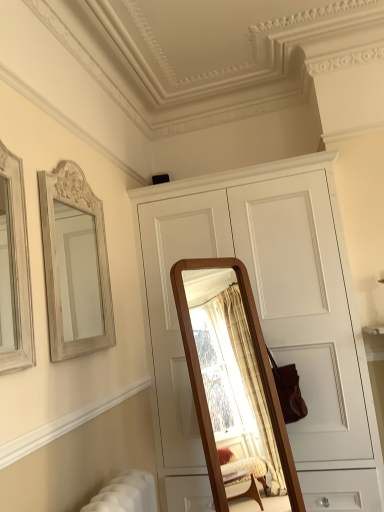
What is the approximate height of white wood cabinet at center?

white wood cabinet at center is 2.23 meters tall.

I want to click on white wood cabinet at center, so click(x=265, y=318).

Image resolution: width=384 pixels, height=512 pixels. What do you see at coordinates (75, 264) in the screenshot?
I see `white carved wood mirror at upper left` at bounding box center [75, 264].

Locate an element on the screen. The image size is (384, 512). wooden frame mirror at left is located at coordinates (14, 269).

From the picture: Is white carved wood mirror at upper left facing towards wooden frame mirror at left?

No, white carved wood mirror at upper left is not aimed at wooden frame mirror at left.

From the image's perspective, is white carved wood mirror at upper left over wooden frame mirror at left?

No, from the image's perspective, white carved wood mirror at upper left is not above wooden frame mirror at left.

Locate an element on the screen. mirror on the right of wooden frame mirror at left is located at coordinates (75, 264).

Which object is closer to the camera, white carved wood mirror at upper left or wooden frame mirror at left?

wooden frame mirror at left.

From the image's perspective, which is above, white carved wood mirror at upper left or white wood cabinet at center?

white carved wood mirror at upper left.

Is white carved wood mirror at upper left closer to the viewer compared to white wood cabinet at center?

Yes, white carved wood mirror at upper left is closer to the viewer.

Does white carved wood mirror at upper left have a greater height compared to white wood cabinet at center?

No.

Is white carved wood mirror at upper left positioned with its back to white wood cabinet at center?

That's not correct — white carved wood mirror at upper left is not looking away from white wood cabinet at center.

Which is correct: white wood cabinet at center is inside white carved wood mirror at upper left, or outside of it?

white wood cabinet at center lies outside white carved wood mirror at upper left.

Is white wood cabinet at center oriented towards white carved wood mirror at upper left?

Yes, white wood cabinet at center is facing white carved wood mirror at upper left.

Considering the positions of objects white wood cabinet at center and white carved wood mirror at upper left in the image provided, who is more to the left, white wood cabinet at center or white carved wood mirror at upper left?

white carved wood mirror at upper left is more to the left.

Is wooden frame mirror at left spatially inside white carved wood mirror at upper left, or outside of it?

The correct answer is: outside.

From the picture: Is wooden frame mirror at left at the right side of white carved wood mirror at upper left?

Incorrect, wooden frame mirror at left is not on the right side of white carved wood mirror at upper left.

From the image's perspective, is wooden frame mirror at left on top of white carved wood mirror at upper left?

Correct, wooden frame mirror at left appears higher than white carved wood mirror at upper left in the image.

Who is taller, white wood cabinet at center or wooden frame mirror at left?

white wood cabinet at center is taller.

You are a GUI agent. You are given a task and a screenshot of the screen. Output one action in this format:
    pyautogui.click(x=<x>, y=<y>)
    Task: Click on the picture frame that is in front of the white wood cabinet at center
    The width and height of the screenshot is (384, 512).
    Given the screenshot: What is the action you would take?
    pyautogui.click(x=14, y=269)

Which object is positioned more to the right, white wood cabinet at center or wooden frame mirror at left?

white wood cabinet at center.

Considering the sizes of objects white wood cabinet at center and wooden frame mirror at left in the image provided, who is bigger, white wood cabinet at center or wooden frame mirror at left?

white wood cabinet at center.

Who is taller, wooden frame mirror at left or white wood cabinet at center?

white wood cabinet at center.

Looking at their sizes, would you say wooden frame mirror at left is wider or thinner than white wood cabinet at center?

wooden frame mirror at left is thinner than white wood cabinet at center.

Relative to white wood cabinet at center, is wooden frame mirror at left in front or behind?

In the image, wooden frame mirror at left appears in front of white wood cabinet at center.

From a real-world perspective, is wooden frame mirror at left on white wood cabinet at center?

Indeed, from a real-world perspective, wooden frame mirror at left stands above white wood cabinet at center.

Where is `mirror behind the wooden frame mirror at left`? Image resolution: width=384 pixels, height=512 pixels. mirror behind the wooden frame mirror at left is located at coordinates (75, 264).

The width and height of the screenshot is (384, 512). Find the location of `cabinetry below the white carved wood mirror at upper left (from the image's perspective)`. cabinetry below the white carved wood mirror at upper left (from the image's perspective) is located at coordinates (265, 318).

Based on the photo, when comparing their distances from white carved wood mirror at upper left, does wooden frame mirror at left or white wood cabinet at center seem further?

white wood cabinet at center lies further to white carved wood mirror at upper left than the other object.

Considering their positions, is white carved wood mirror at upper left positioned closer to white wood cabinet at center than wooden frame mirror at left?

The object closer to white wood cabinet at center is white carved wood mirror at upper left.

From the image, which object appears to be nearer to wooden frame mirror at left, white wood cabinet at center or white carved wood mirror at upper left?

Based on the image, white carved wood mirror at upper left appears to be nearer to wooden frame mirror at left.

Which object lies further to the anchor point white wood cabinet at center, wooden frame mirror at left or white carved wood mirror at upper left?

wooden frame mirror at left.

When comparing their distances from wooden frame mirror at left, does white carved wood mirror at upper left or white wood cabinet at center seem closer?

white carved wood mirror at upper left is positioned closer to the anchor wooden frame mirror at left.

Which object lies further to the anchor point white carved wood mirror at upper left, white wood cabinet at center or wooden frame mirror at left?

The object further to white carved wood mirror at upper left is white wood cabinet at center.

Locate an element on the screen. The image size is (384, 512). mirror situated between wooden frame mirror at left and white wood cabinet at center from left to right is located at coordinates (75, 264).